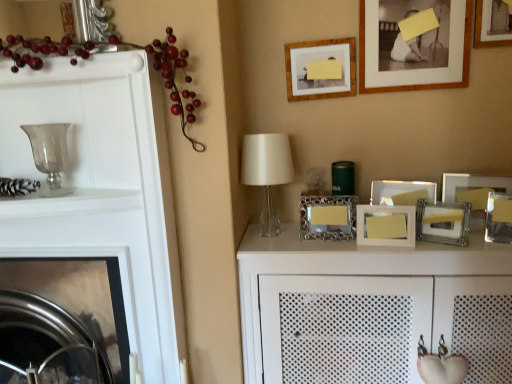
Question: Should I look upward or downward to see metallic silver picture frame at right, which is the 5th picture frame from bottom to top?

Choices:
 (A) up
 (B) down

Answer: (B)

Question: Is the position of wooden picture frame at center-right, which is the first picture frame in bottom-to-top order, more distant than that of transparent glass candle holder at left?

Choices:
 (A) yes
 (B) no

Answer: (A)

Question: Is wooden picture frame at center-right, which is the first picture frame in bottom-to-top order, surrounding transparent glass candle holder at left?

Choices:
 (A) yes
 (B) no

Answer: (B)

Question: Is there a large distance between wooden picture frame at center-right, the 9th picture frame from the top, and transparent glass candle holder at left?

Choices:
 (A) yes
 (B) no

Answer: (A)

Question: Can you see wooden picture frame at center-right, which is the first picture frame in bottom-to-top order, touching transparent glass candle holder at left?

Choices:
 (A) no
 (B) yes

Answer: (A)

Question: From a real-world perspective, is wooden picture frame at center-right, which is the first picture frame in bottom-to-top order, on top of transparent glass candle holder at left?

Choices:
 (A) yes
 (B) no

Answer: (B)

Question: Is wooden picture frame at center-right, which is the first picture frame in bottom-to-top order, facing away from transparent glass candle holder at left?

Choices:
 (A) yes
 (B) no

Answer: (B)

Question: Is wooden picture frame at center-right, the 9th picture frame from the top, looking in the opposite direction of glossy plastic berries at left?

Choices:
 (A) no
 (B) yes

Answer: (A)

Question: Would you say wooden picture frame at center-right, the 9th picture frame from the top, is outside glossy plastic berries at left?

Choices:
 (A) yes
 (B) no

Answer: (A)

Question: Is glossy plastic berries at left located within wooden picture frame at center-right, the 9th picture frame from the top?

Choices:
 (A) no
 (B) yes

Answer: (A)

Question: Is wooden picture frame at center-right, which is the first picture frame in bottom-to-top order, bigger than glossy plastic berries at left?

Choices:
 (A) yes
 (B) no

Answer: (B)

Question: Is wooden picture frame at center-right, the 9th picture frame from the top, closer to the viewer compared to glossy plastic berries at left?

Choices:
 (A) no
 (B) yes

Answer: (A)

Question: Is wooden picture frame at center-right, which is the first picture frame in bottom-to-top order, to the left of glossy plastic berries at left from the viewer's perspective?

Choices:
 (A) yes
 (B) no

Answer: (B)

Question: Is metallic silver picture frame at right, which appears as the 4th picture frame when ordered from the bottom, shorter than metallic silver picture frame at center-right, which is the fourth picture frame in top-to-bottom order?

Choices:
 (A) no
 (B) yes

Answer: (A)